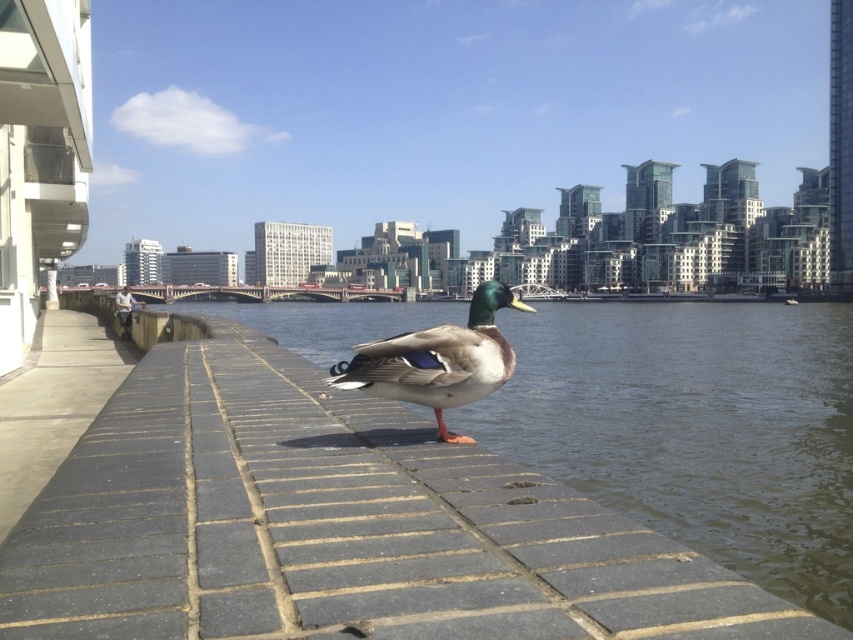
Question: Among these points, which one is nearest to the camera?

Choices:
 (A) (715, 529)
 (B) (44, 392)
 (C) (479, 349)

Answer: (C)

Question: Can you confirm if gray concrete pavement at lower left is thinner than green glossy duck at center?

Choices:
 (A) yes
 (B) no

Answer: (B)

Question: Is gray concrete pavement at lower left above green glossy duck at center?

Choices:
 (A) yes
 (B) no

Answer: (B)

Question: Considering the real-world distances, which object is farthest from the gray concrete pavement at lower left?

Choices:
 (A) clear water at center
 (B) green glossy duck at center

Answer: (A)

Question: Which object is farther from the camera taking this photo?

Choices:
 (A) gray concrete pavement at lower left
 (B) green glossy duck at center
 (C) clear water at center

Answer: (C)

Question: Is clear water at center above gray concrete pavement at lower left?

Choices:
 (A) yes
 (B) no

Answer: (A)